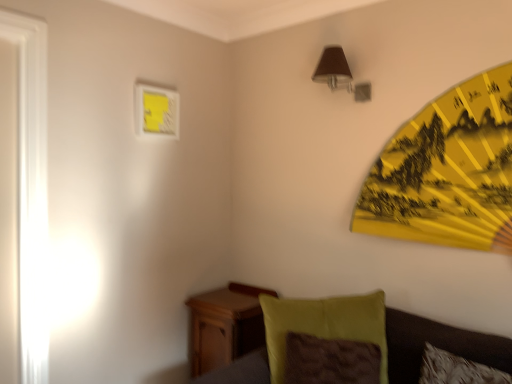
Question: Relative to yellow paper umbrella at upper right, is velvety green pillow at lower right in front or behind?

Choices:
 (A) behind
 (B) front

Answer: (B)

Question: Considering the positions of point (331, 301) and point (458, 97), is point (331, 301) closer or farther from the camera than point (458, 97)?

Choices:
 (A) closer
 (B) farther

Answer: (B)

Question: Based on their relative distances, which object is nearer to the yellow paper umbrella at upper right?

Choices:
 (A) matte yellow picture frame at upper left
 (B) velvet green couch at lower right
 (C) wooden nightstand at lower left
 (D) velvety green pillow at lower right
 (E) brown fabric lampshade at upper right

Answer: (E)

Question: Estimate the real-world distances between objects in this image. Which object is closer to the brown fabric lampshade at upper right?

Choices:
 (A) velvety green pillow at lower right
 (B) yellow paper umbrella at upper right
 (C) velvet green couch at lower right
 (D) wooden nightstand at lower left
 (E) matte yellow picture frame at upper left

Answer: (B)